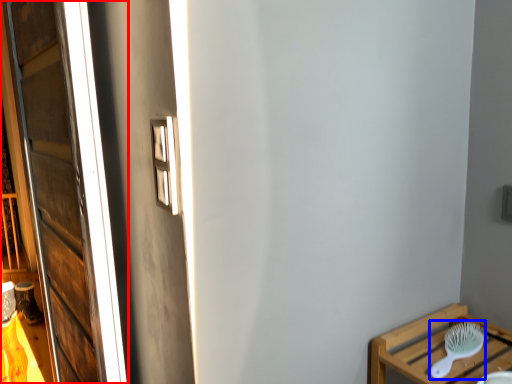
Question: Which object is further to the camera taking this photo, window (highlighted by a red box) or brush (highlighted by a blue box)?

Choices:
 (A) window
 (B) brush

Answer: (B)